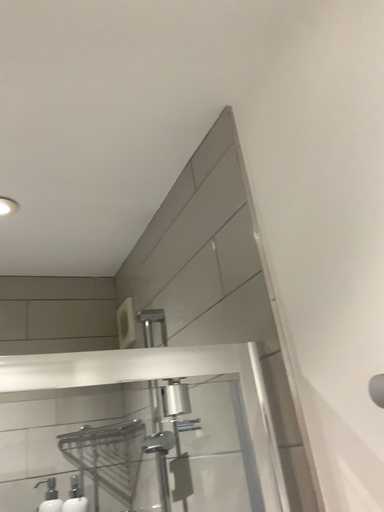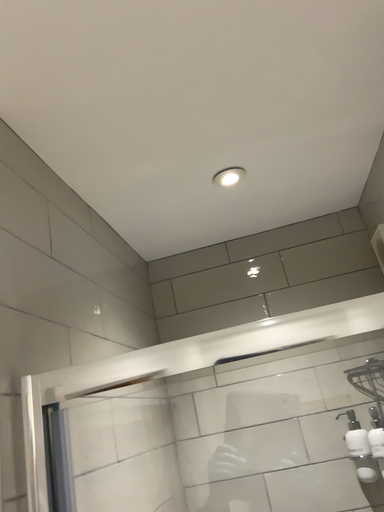
Question: Which way did the camera rotate in the video?

Choices:
 (A) rotated right
 (B) rotated left

Answer: (B)